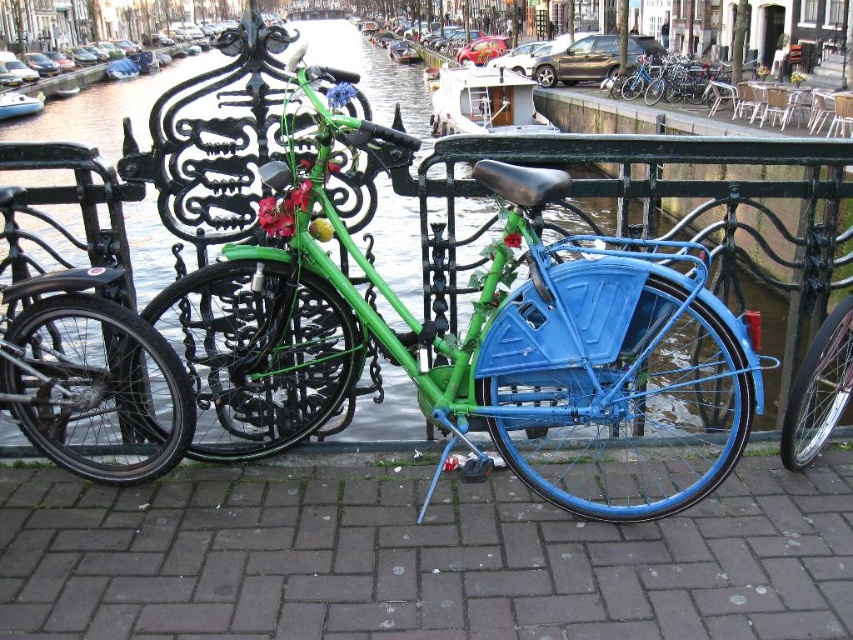
Between green matte bicycle at center and shiny black bicycle at left, which one is positioned lower?

green matte bicycle at center

Does green matte bicycle at center have a greater width compared to shiny black bicycle at left?

Yes.

Does point (202, 310) come behind point (86, 205)?

That is True.

In order to click on green matte bicycle at center in this screenshot , I will do coord(485,340).

Which is more to the left, blue rubber pavement at center or green matte bicycle at center?

Positioned to the left is blue rubber pavement at center.

In the scene shown: Can you confirm if blue rubber pavement at center is smaller than green matte bicycle at center?

No, blue rubber pavement at center is not smaller than green matte bicycle at center.

Does point (372, 609) come in front of point (260, 305)?

Yes, point (372, 609) is in front of point (260, 305).

I want to click on blue rubber pavement at center, so pos(418,557).

Is green matte bicycle at center below blue metallic bicycle at center?

No, green matte bicycle at center is not below blue metallic bicycle at center.

Does green matte bicycle at center lie behind blue metallic bicycle at center?

No, green matte bicycle at center is in front of blue metallic bicycle at center.

Who is more distant from viewer, (329, 214) or (787, 413)?

The point (787, 413) is behind.

Where is `green matte bicycle at center`? This screenshot has height=640, width=853. green matte bicycle at center is located at coordinates (485, 340).